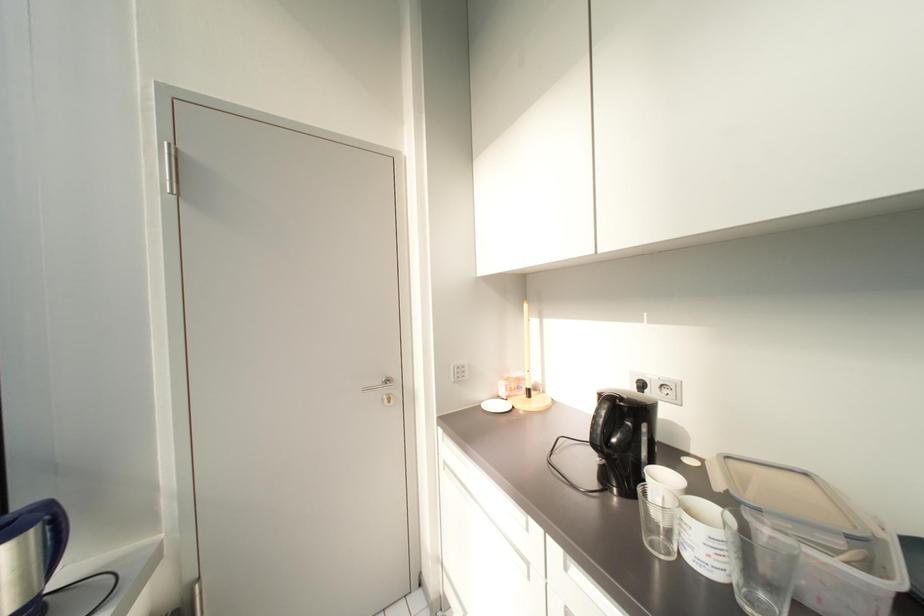
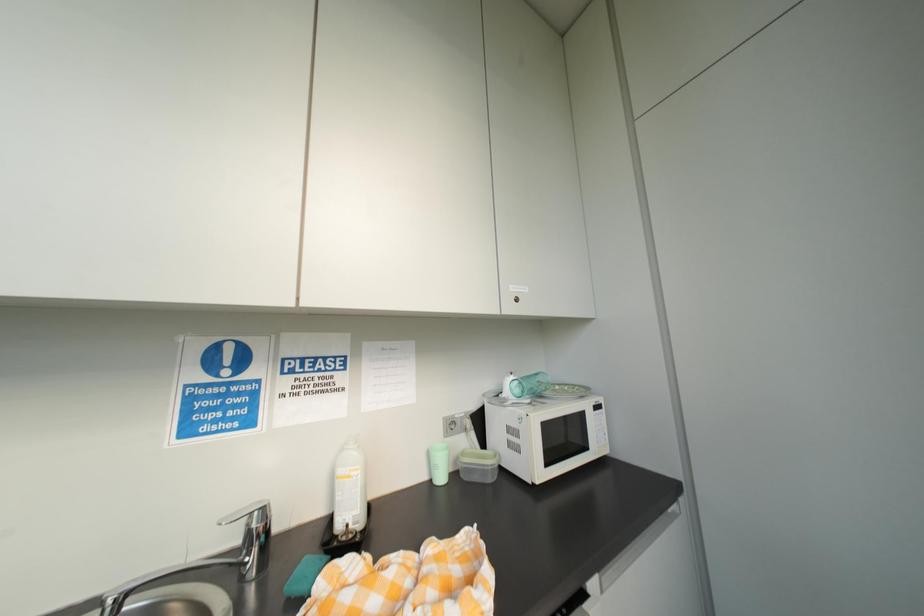
Question: The camera is either moving clockwise (left) or counter-clockwise (right) around the object. The first image is from the beginning of the video and the second image is from the end. Is the camera moving left or right when shooting the video?

Choices:
 (A) Left
 (B) Right

Answer: (A)